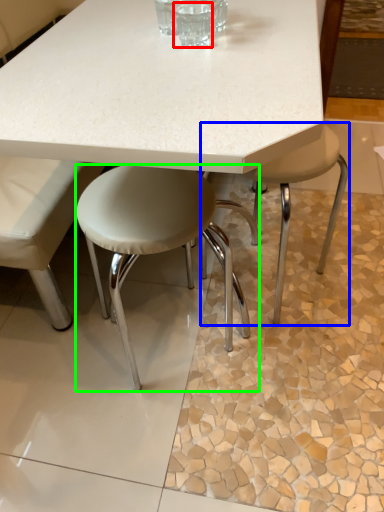
Question: Considering the real-world distances, which object is farthest from clear (highlighted by a red box)? stool (highlighted by a blue box) or stool (highlighted by a green box)?

Choices:
 (A) stool
 (B) stool

Answer: (A)